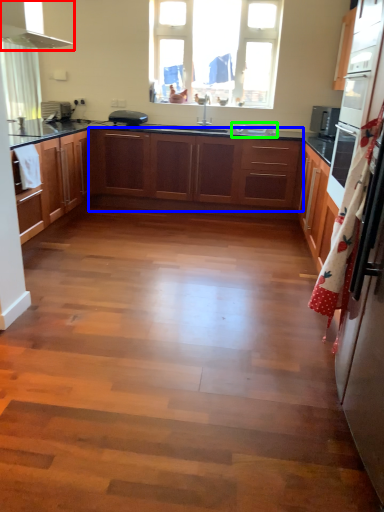
Question: Which object is the closest to the exhaust hood (highlighted by a red box)? Choose among these: cabinetry (highlighted by a blue box) or sink (highlighted by a green box).

Choices:
 (A) cabinetry
 (B) sink

Answer: (A)